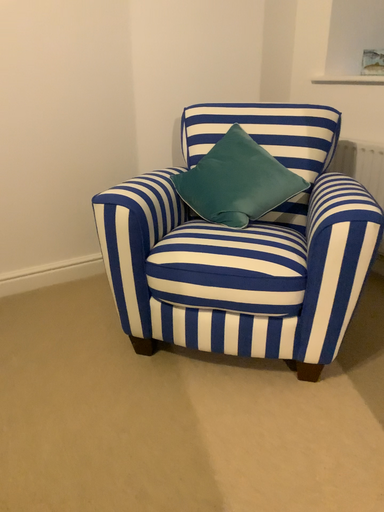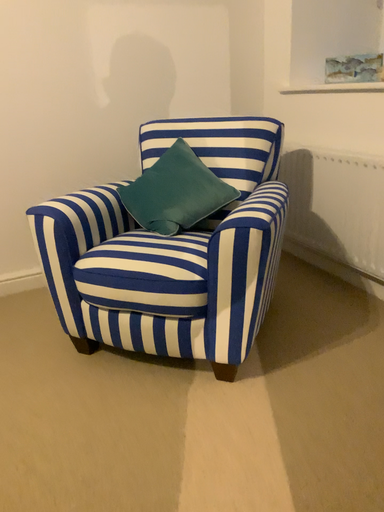
Question: Which way did the camera rotate in the video?

Choices:
 (A) rotated left
 (B) rotated right

Answer: (A)